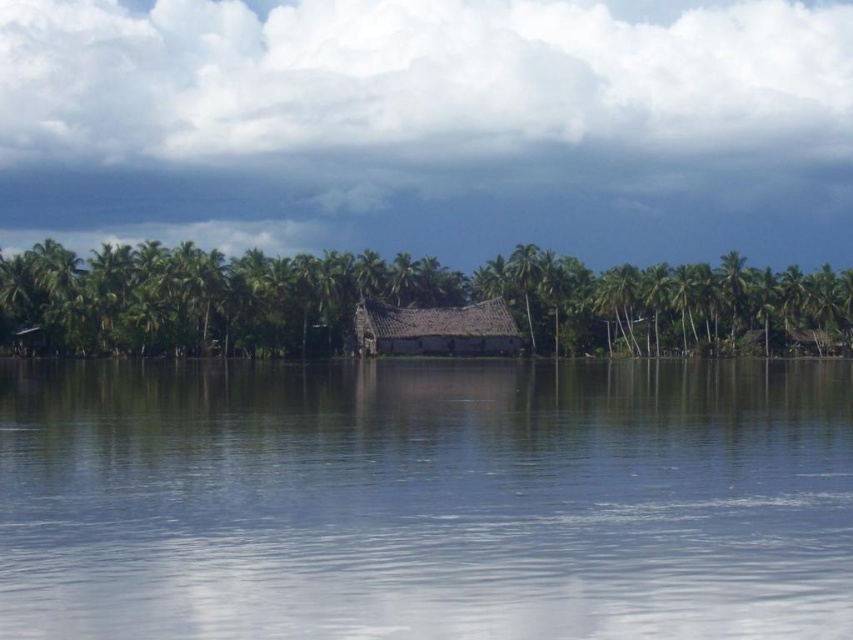
Which is above, clear water at center or green leafy palm tree at right?

green leafy palm tree at right is higher up.

Does clear water at center have a larger size compared to green leafy palm tree at right?

No.

At what (x,y) coordinates should I click in order to perform the action: click on clear water at center. Please return your answer as a coordinate pair (x, y). Looking at the image, I should click on (426, 499).

You are a GUI agent. You are given a task and a screenshot of the screen. Output one action in this format:
    pyautogui.click(x=<x>, y=<y>)
    Task: Click on the clear water at center
    Image resolution: width=853 pixels, height=640 pixels.
    Given the screenshot: What is the action you would take?
    pyautogui.click(x=426, y=499)

Does clear water at center have a greater width compared to green leafy palm tree at center?

Yes.

Does point (546, 538) come behind point (511, 253)?

That is False.

I want to click on clear water at center, so 426,499.

Which of these two, brown thatched hut at center or green leafy palm tree at center, stands taller?

green leafy palm tree at center is taller.

Is brown thatched hut at center further to the viewer compared to green leafy palm tree at center?

No, brown thatched hut at center is closer to the viewer.

Which is behind, point (357, 349) or point (525, 248)?

Point (525, 248)

The width and height of the screenshot is (853, 640). I want to click on brown thatched hut at center, so click(x=434, y=330).